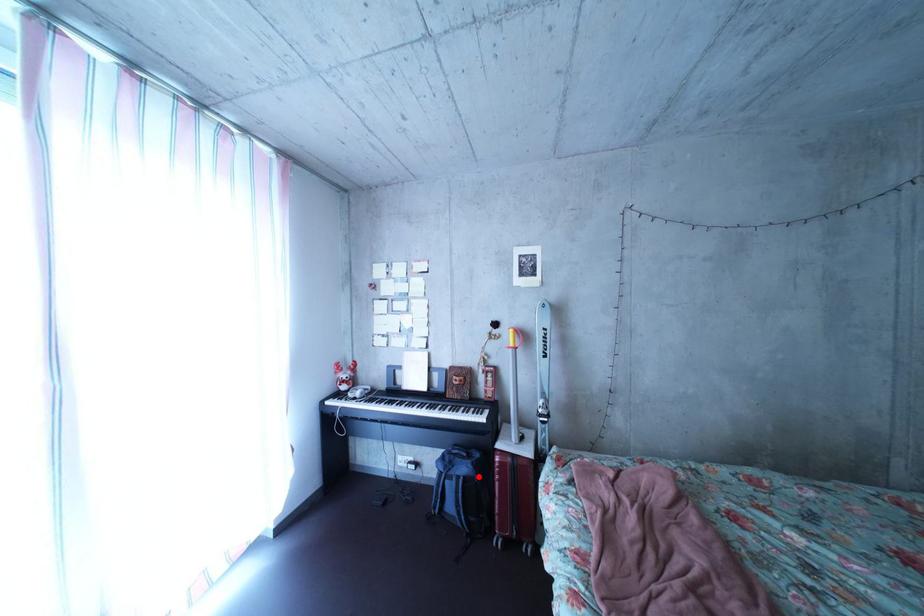
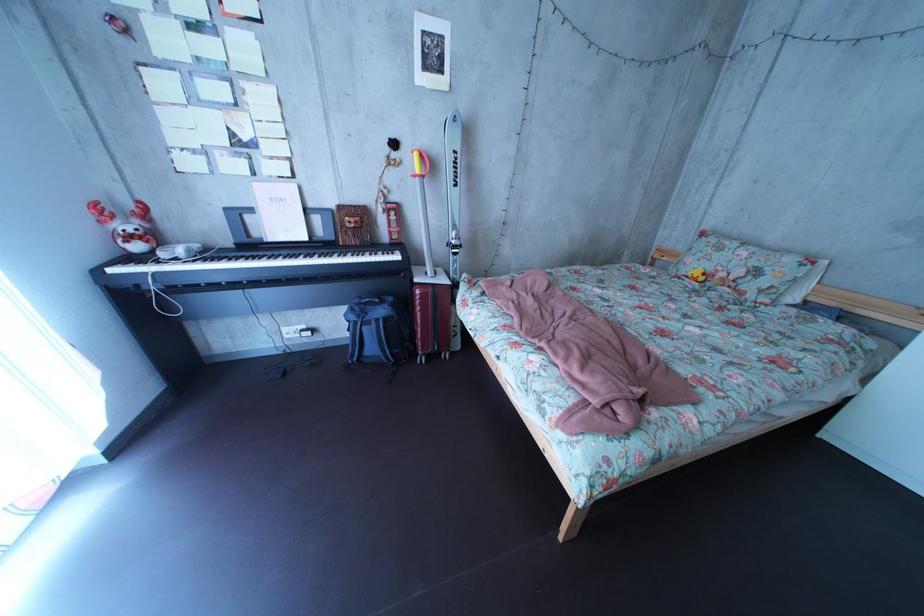
In the second image, find the point that corresponds to the highlighted location in the first image.

(395, 320)